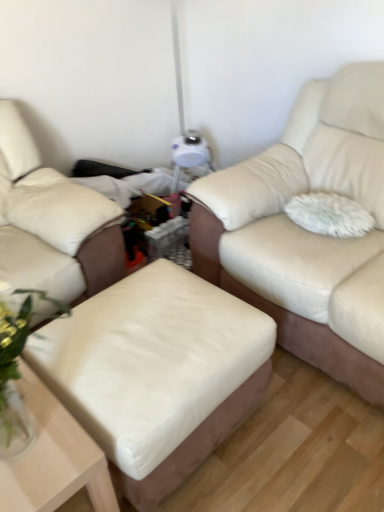
What do you see at coordinates (52, 223) in the screenshot?
I see `beige leather ottoman at lower left, which is counted as the first studio couch, starting from the left` at bounding box center [52, 223].

Measure the distance between white leather ottoman at center and camera.

white leather ottoman at center is 1.07 meters away from camera.

Where is `white matte table at lower left`? This screenshot has width=384, height=512. white matte table at lower left is located at coordinates (53, 457).

Find the location of a particular element. This screenshot has width=384, height=512. beige leather ottoman at lower left, which appears as the 2th studio couch when viewed from the right is located at coordinates (52, 223).

Is white matte table at lower left aimed at white fluffy pillow at right?

No, white matte table at lower left is not turned towards white fluffy pillow at right.

Are white matte table at lower left and white fluffy pillow at right beside each other?

They are not placed beside each other.

Would you say white matte table at lower left is outside white fluffy pillow at right?

Yes, white matte table at lower left is outside of white fluffy pillow at right.

Is white leather ottoman at center a part of wooden cocktail table at center?

Actually, white leather ottoman at center is outside wooden cocktail table at center.

Is wooden cocktail table at center positioned in front of white leather ottoman at center?

No, it is behind white leather ottoman at center.

Considering the positions of objects wooden cocktail table at center and white leather ottoman at center in the image provided, who is more to the right, wooden cocktail table at center or white leather ottoman at center?

white leather ottoman at center.

From the image's perspective, is beige leather ottoman at lower left, which appears as the 2th studio couch when viewed from the right, located above matte cream leather couch at center, which is counted as the 1th studio couch, starting from the right?

Yes, from the image's perspective, beige leather ottoman at lower left, which appears as the 2th studio couch when viewed from the right, is above matte cream leather couch at center, which is counted as the 1th studio couch, starting from the right.

Is beige leather ottoman at lower left, which appears as the 2th studio couch when viewed from the right, situated inside matte cream leather couch at center, marked as the 2th studio couch in a left-to-right arrangement, or outside?

beige leather ottoman at lower left, which appears as the 2th studio couch when viewed from the right, is located beyond the bounds of matte cream leather couch at center, marked as the 2th studio couch in a left-to-right arrangement.

Which object is thinner, beige leather ottoman at lower left, which is counted as the first studio couch, starting from the left, or matte cream leather couch at center, marked as the 2th studio couch in a left-to-right arrangement?

With smaller width is matte cream leather couch at center, marked as the 2th studio couch in a left-to-right arrangement.

Are beige leather ottoman at lower left, which is counted as the first studio couch, starting from the left, and matte cream leather couch at center, which is counted as the 1th studio couch, starting from the right, making contact?

There is a gap between beige leather ottoman at lower left, which is counted as the first studio couch, starting from the left, and matte cream leather couch at center, which is counted as the 1th studio couch, starting from the right.

In the scene shown: Can you confirm if white fluffy pillow at right is taller than matte cream leather couch at center, which is counted as the 1th studio couch, starting from the right?

In fact, white fluffy pillow at right may be shorter than matte cream leather couch at center, which is counted as the 1th studio couch, starting from the right.

From the image's perspective, is white fluffy pillow at right under matte cream leather couch at center, which is counted as the 1th studio couch, starting from the right?

Yes.

Is white fluffy pillow at right located outside matte cream leather couch at center, marked as the 2th studio couch in a left-to-right arrangement?

No, white fluffy pillow at right is inside matte cream leather couch at center, marked as the 2th studio couch in a left-to-right arrangement,'s boundary.

Is point (325, 228) in front of point (196, 232)?

Yes, it is.

Does wooden cocktail table at center have a lesser height compared to white matte table at lower left?

Yes, wooden cocktail table at center is shorter than white matte table at lower left.

Can you confirm if wooden cocktail table at center is positioned to the right of white matte table at lower left?

Yes, wooden cocktail table at center is to the right of white matte table at lower left.

Can white matte table at lower left be found inside wooden cocktail table at center?

Definitely not — white matte table at lower left is not inside wooden cocktail table at center.

Is wooden cocktail table at center smaller than white matte table at lower left?

Yes.

Does white fluffy pillow at right turn towards beige leather ottoman at lower left, which appears as the 2th studio couch when viewed from the right?

No, white fluffy pillow at right is not oriented towards beige leather ottoman at lower left, which appears as the 2th studio couch when viewed from the right.

Could you measure the distance between white fluffy pillow at right and beige leather ottoman at lower left, which appears as the 2th studio couch when viewed from the right?

They are 1.03 meters apart.

Based on the photo, from a real-world perspective, relative to beige leather ottoman at lower left, which is counted as the first studio couch, starting from the left, is white fluffy pillow at right vertically above or below?

white fluffy pillow at right is above beige leather ottoman at lower left, which is counted as the first studio couch, starting from the left.

From the image's perspective, is white fluffy pillow at right above beige leather ottoman at lower left, which is counted as the first studio couch, starting from the left?

No.

Consider the image. Is there a large distance between matte cream leather couch at center, marked as the 2th studio couch in a left-to-right arrangement, and white leather ottoman at center?

matte cream leather couch at center, marked as the 2th studio couch in a left-to-right arrangement, is near white leather ottoman at center, not far away.

From the image's perspective, is matte cream leather couch at center, marked as the 2th studio couch in a left-to-right arrangement, on top of white leather ottoman at center?

Yes, from the image's perspective, matte cream leather couch at center, marked as the 2th studio couch in a left-to-right arrangement, is above white leather ottoman at center.

From a real-world perspective, which is physically below, matte cream leather couch at center, which is counted as the 1th studio couch, starting from the right, or white leather ottoman at center?

In real-world perspective, white leather ottoman at center is lower.

You are a GUI agent. You are given a task and a screenshot of the screen. Output one action in this format:
    pyautogui.click(x=<x>, y=<y>)
    Task: Click on the table that is on the left side of white fluffy pillow at right
    This screenshot has height=512, width=384.
    Given the screenshot: What is the action you would take?
    pyautogui.click(x=53, y=457)

Locate an element on the screen. The image size is (384, 512). cocktail table below the white leather ottoman at center (from a real-world perspective) is located at coordinates (163, 227).

From the image, which object appears to be farther from white fluffy pillow at right, wooden cocktail table at center or white matte table at lower left?

Based on the image, white matte table at lower left appears to be further to white fluffy pillow at right.

Estimate the real-world distances between objects in this image. Which object is further from white leather ottoman at center, white matte table at lower left or matte cream leather couch at center, marked as the 2th studio couch in a left-to-right arrangement?

Based on the image, matte cream leather couch at center, marked as the 2th studio couch in a left-to-right arrangement, appears to be further to white leather ottoman at center.

Estimate the real-world distances between objects in this image. Which object is closer to white fluffy pillow at right, white matte table at lower left or matte cream leather couch at center, which is counted as the 1th studio couch, starting from the right?

matte cream leather couch at center, which is counted as the 1th studio couch, starting from the right, is closer to white fluffy pillow at right.

Looking at the image, which one is located closer to wooden cocktail table at center, white fluffy pillow at right or beige leather ottoman at lower left, which appears as the 2th studio couch when viewed from the right?

beige leather ottoman at lower left, which appears as the 2th studio couch when viewed from the right.

Based on their spatial positions, is beige leather ottoman at lower left, which appears as the 2th studio couch when viewed from the right, or white fluffy pillow at right closer to wooden cocktail table at center?

The object closer to wooden cocktail table at center is beige leather ottoman at lower left, which appears as the 2th studio couch when viewed from the right.

Based on their spatial positions, is wooden cocktail table at center or matte cream leather couch at center, marked as the 2th studio couch in a left-to-right arrangement, further from white matte table at lower left?

Based on the image, wooden cocktail table at center appears to be further to white matte table at lower left.

Based on their spatial positions, is white fluffy pillow at right or matte cream leather couch at center, which is counted as the 1th studio couch, starting from the right, further from white matte table at lower left?

white fluffy pillow at right is positioned further to the anchor white matte table at lower left.

Which object lies further to the anchor point white leather ottoman at center, white fluffy pillow at right or white matte table at lower left?

white fluffy pillow at right is positioned further to the anchor white leather ottoman at center.

Find the location of a particular element. Image resolution: width=384 pixels, height=512 pixels. studio couch between white leather ottoman at center and wooden cocktail table at center along the z-axis is located at coordinates (52, 223).

You are a GUI agent. You are given a task and a screenshot of the screen. Output one action in this format:
    pyautogui.click(x=<x>, y=<y>)
    Task: Click on the table between beige leather ottoman at lower left, which appears as the 2th studio couch when viewed from the right, and white fluffy pillow at right, in the horizontal direction
    This screenshot has height=512, width=384.
    Given the screenshot: What is the action you would take?
    pyautogui.click(x=53, y=457)

At what (x,y) coordinates should I click in order to perform the action: click on stool located between matte cream leather couch at center, which is counted as the 1th studio couch, starting from the right, and wooden cocktail table at center in the depth direction. Please return your answer as a coordinate pair (x, y). Looking at the image, I should click on (157, 373).

Locate an element on the screen. The width and height of the screenshot is (384, 512). table located between beige leather ottoman at lower left, which appears as the 2th studio couch when viewed from the right, and matte cream leather couch at center, marked as the 2th studio couch in a left-to-right arrangement, in the left-right direction is located at coordinates (53, 457).